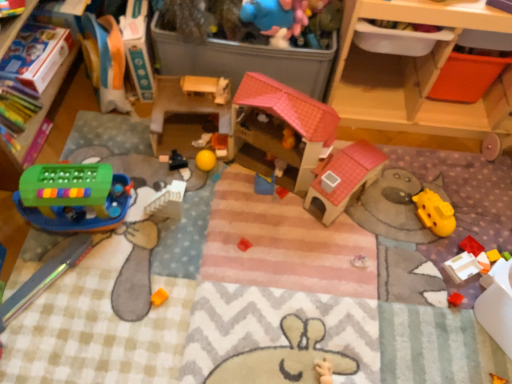
Identify the location of free region on the left part of yellow plastic spoon at center, the 7th toy when ordered from left to right. (221, 191).